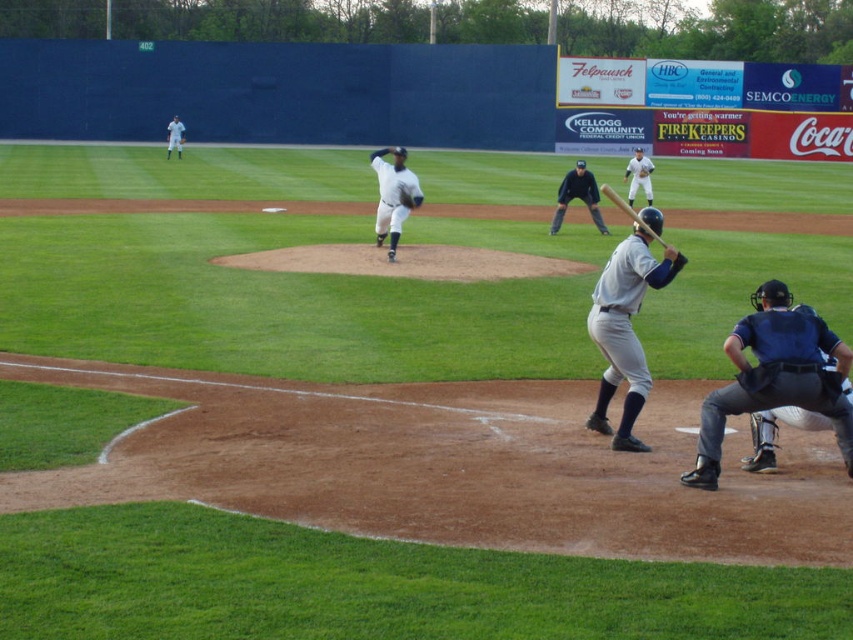
Question: Based on their relative distances, which object is farther from the white leather glove at center?

Choices:
 (A) white uniform at upper left
 (B) blue padded gear at lower right
 (C) dark blue uniform at center

Answer: (B)

Question: Does blue padded gear at lower right appear under dark blue uniform at center?

Choices:
 (A) no
 (B) yes

Answer: (B)

Question: Estimate the real-world distances between objects in this image. Which object is closer to the dark blue uniform at center?

Choices:
 (A) blue padded gear at lower right
 (B) white leather glove at center
 (C) white uniform at center
 (D) wooden baseball bat at center

Answer: (D)

Question: Which of the following is the closest to the observer?

Choices:
 (A) (650, 172)
 (B) (622, 282)

Answer: (B)

Question: Is dark blue uniform at center to the left of white leather glove at center from the viewer's perspective?

Choices:
 (A) no
 (B) yes

Answer: (B)

Question: Does white matte baseball glove at center have a smaller size compared to white uniform at upper left?

Choices:
 (A) no
 (B) yes

Answer: (B)